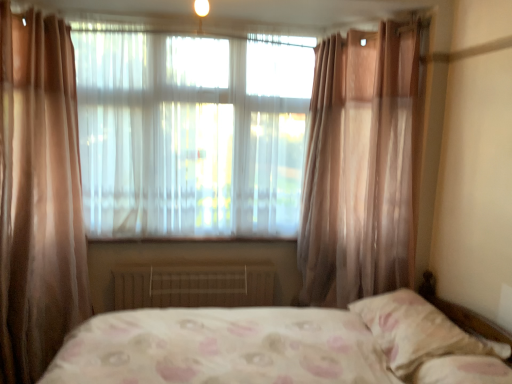
Question: Relative to white floral fabric pillow at lower right, is sheer pink curtain at right in front or behind?

Choices:
 (A) front
 (B) behind

Answer: (B)

Question: In terms of size, does sheer pink curtain at right appear bigger or smaller than white floral fabric pillow at lower right?

Choices:
 (A) small
 (B) big

Answer: (B)

Question: Which of these objects is positioned farthest from the sheer pink curtain at right?

Choices:
 (A) metallic radiator at center
 (B) white floral fabric pillow at lower right
 (C) translucent fabric window at center
 (D) matte white light at upper center

Answer: (D)

Question: Estimate the real-world distances between objects in this image. Which object is closer to the matte white light at upper center?

Choices:
 (A) white floral fabric pillow at lower right
 (B) sheer pink curtain at right
 (C) translucent fabric window at center
 (D) metallic radiator at center

Answer: (C)